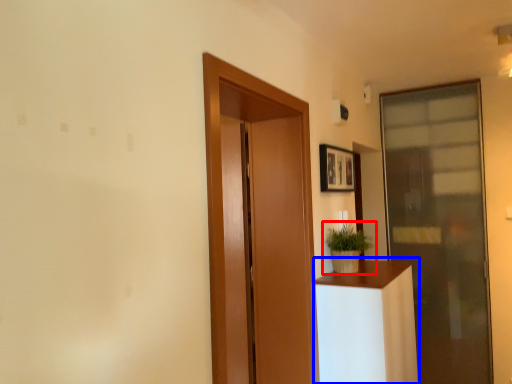
Question: Which point is closer to the camera, houseplant (highlighted by a red box) or furniture (highlighted by a blue box)?

Choices:
 (A) houseplant
 (B) furniture

Answer: (B)